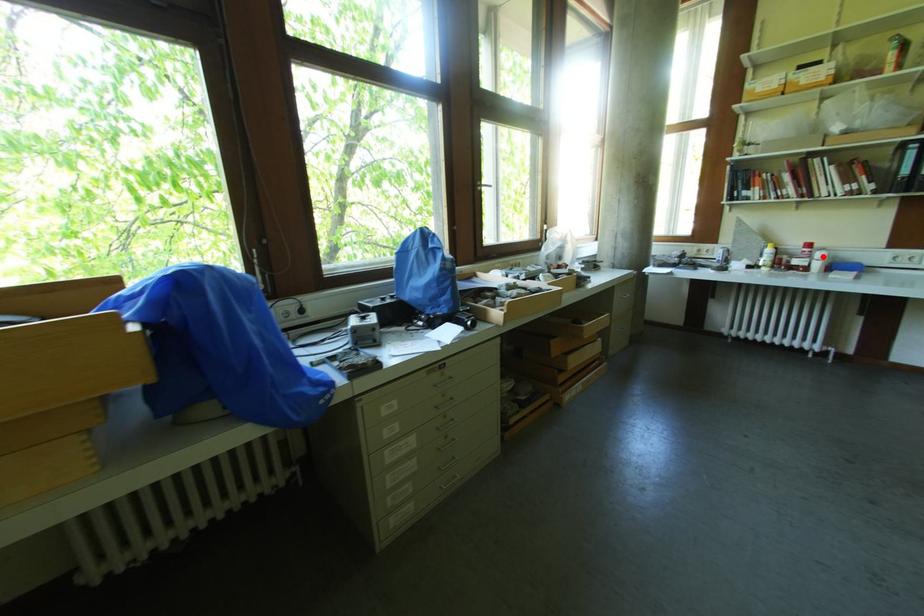
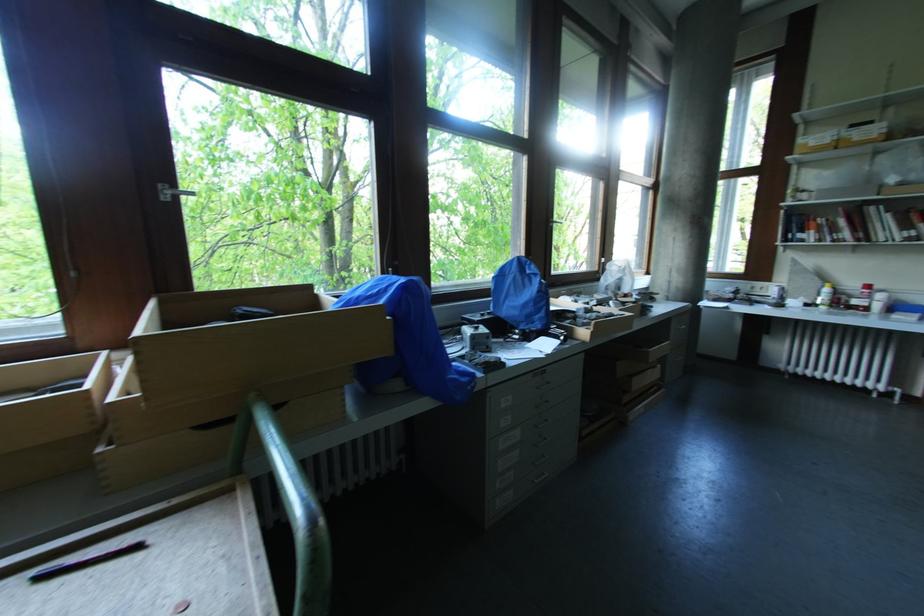
Find the pixel in the second image that matches the highlighted location in the first image.

(882, 298)